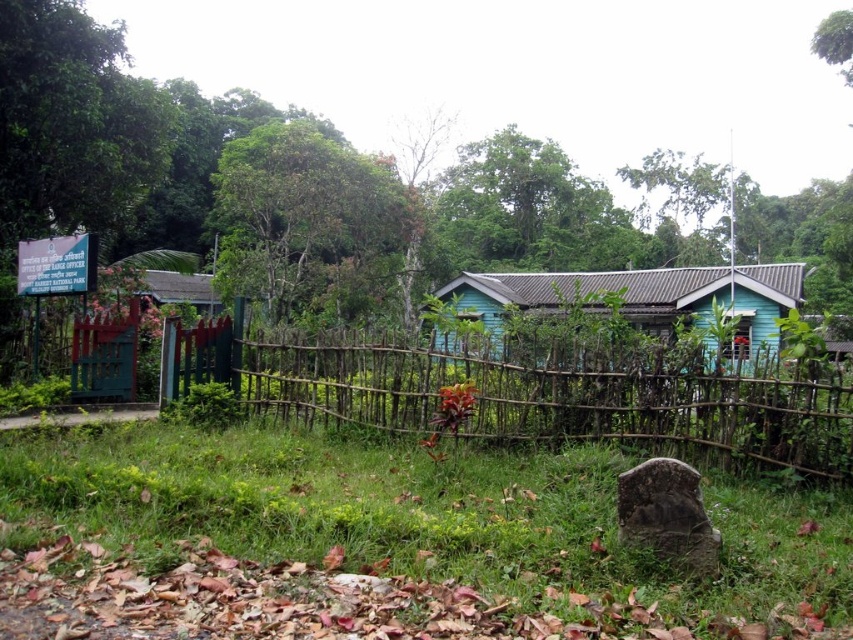
You are standing at the front of the building and want to walk towards the point that is closer to you. Which point should you head towards, point (332, 355) or point (595, 292)?

You should head towards point (332, 355) because it is closer to the viewer than point (595, 292).

Based on the photo, you are standing in the middle of the green grass at center and want to see the top of the blue wooden hut at center. Can you see it without moving your position?

The green grass at center has a lesser height compared to blue wooden hut at center, so yes, you can see the top of the blue wooden hut at center from your current position in the green grass at center since the grass is shorter than the hut.